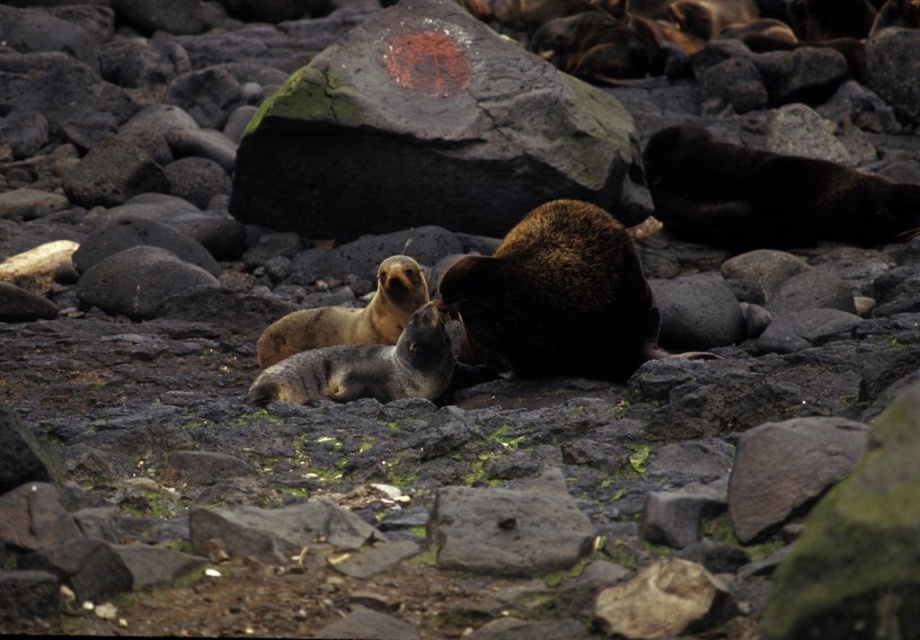
Can you confirm if gray fur seal at center is bigger than golden fur seal at center?

Incorrect, gray fur seal at center is not larger than golden fur seal at center.

Image resolution: width=920 pixels, height=640 pixels. I want to click on gray fur seal at center, so click(x=365, y=368).

Who is more forward, (409, 380) or (394, 260)?

Point (409, 380)

I want to click on gray fur seal at center, so click(x=365, y=368).

Can you confirm if brown fuzzy seal at upper right is thinner than golden fur seal at center?

No.

Does brown fuzzy seal at upper right come in front of golden fur seal at center?

No, brown fuzzy seal at upper right is behind golden fur seal at center.

Is point (654, 193) in front of point (370, 310)?

No, (654, 193) is further to viewer.

Locate an element on the screen. brown fuzzy seal at upper right is located at coordinates (768, 195).

The width and height of the screenshot is (920, 640). What do you see at coordinates (768, 195) in the screenshot?
I see `brown fuzzy seal at upper right` at bounding box center [768, 195].

Is point (719, 204) in front of point (296, 358)?

No, it is behind (296, 358).

Measure the distance between brown fuzzy seal at upper right and camera.

brown fuzzy seal at upper right and camera are 8.94 meters apart from each other.

Image resolution: width=920 pixels, height=640 pixels. Identify the location of brown fuzzy seal at upper right. pyautogui.click(x=768, y=195).